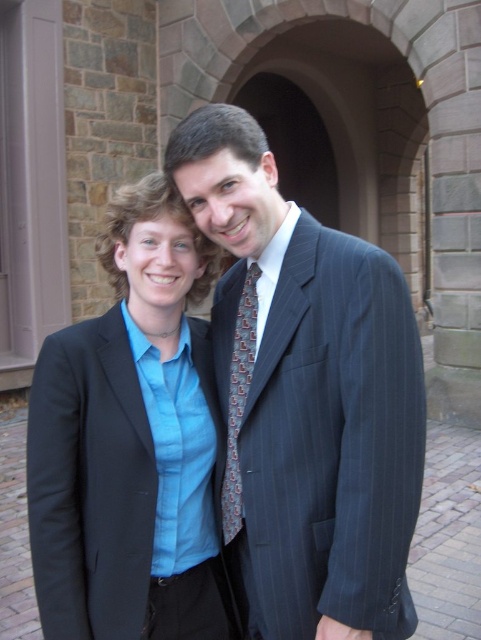
Is pinstriped suit at center positioned before matte blue shirt at center?

That is True.

Consider the image. Can you confirm if pinstriped suit at center is positioned above matte blue shirt at center?

Correct, pinstriped suit at center is located above matte blue shirt at center.

Between point (198, 138) and point (151, 288), which one is positioned in front?

Point (198, 138) is in front.

Identify the location of pinstriped suit at center. (306, 397).

Is matte blue shirt at center above patterned silk tie at center?

No.

Who is taller, matte blue shirt at center or patterned silk tie at center?

With more height is matte blue shirt at center.

In the scene shown: Who is more distant from viewer, (111, 560) or (235, 440)?

The point (235, 440) is behind.

Locate an element on the screen. matte blue shirt at center is located at coordinates (129, 442).

Which is below, pinstriped suit at center or patterned silk tie at center?

Positioned lower is patterned silk tie at center.

Who is higher up, pinstriped suit at center or patterned silk tie at center?

pinstriped suit at center is higher up.

Between point (276, 632) and point (228, 465), which one is positioned in front?

Point (276, 632)

You are a GUI agent. You are given a task and a screenshot of the screen. Output one action in this format:
    pyautogui.click(x=<x>, y=<y>)
    Task: Click on the pinstriped suit at center
    
    Given the screenshot: What is the action you would take?
    pyautogui.click(x=306, y=397)